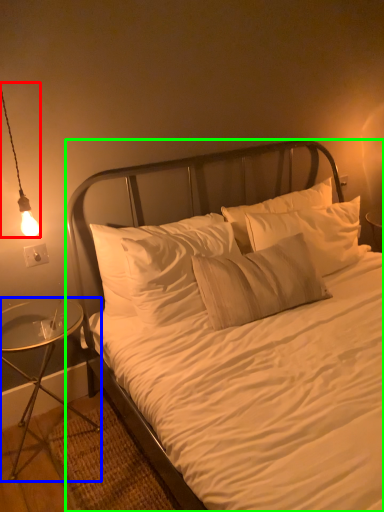
Question: Considering the real-world distances, which object is farthest from lamp (highlighted by a red box)? nightstand (highlighted by a blue box) or bed (highlighted by a green box)?

Choices:
 (A) nightstand
 (B) bed

Answer: (B)